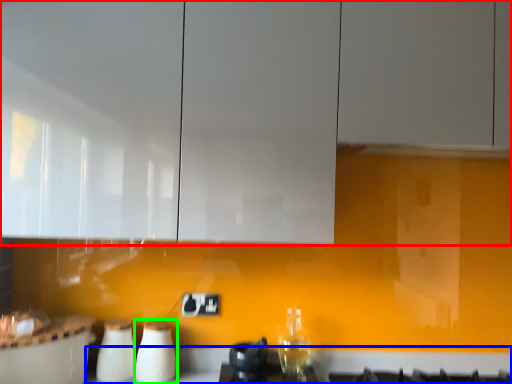
Question: Which object is the farthest from cabinetry (highlighted by a red box)? Choose among these: counter top (highlighted by a blue box) or appliance (highlighted by a green box).

Choices:
 (A) counter top
 (B) appliance

Answer: (A)